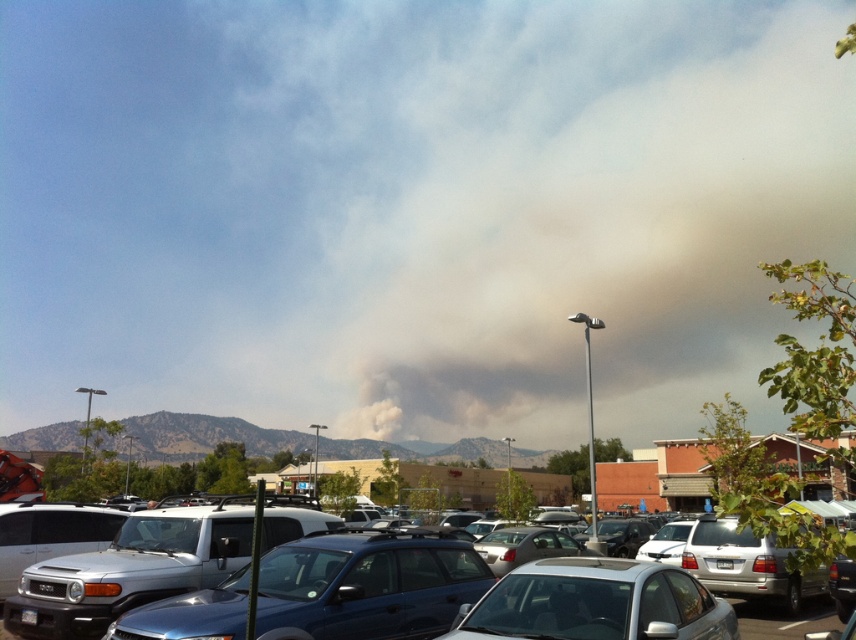
Question: Is metallic blue suv at center smaller than smokey gray sedan at center?

Choices:
 (A) yes
 (B) no

Answer: (B)

Question: Which point appears farthest from the camera in this image?

Choices:
 (A) (272, 621)
 (B) (761, 637)

Answer: (B)

Question: Is metallic blue suv at center in front of smokey gray sedan at center?

Choices:
 (A) yes
 (B) no

Answer: (B)

Question: Does smokey gray sedan at center have a larger size compared to metallic silver car at center?

Choices:
 (A) yes
 (B) no

Answer: (B)

Question: Which object is closer to the camera taking this photo?

Choices:
 (A) metallic blue suv at center
 (B) metallic silver car at center
 (C) smokey gray sedan at center

Answer: (C)

Question: Which object is closer to the camera taking this photo?

Choices:
 (A) metallic silver car at center
 (B) smokey gray sedan at center
 (C) metallic blue suv at center

Answer: (B)